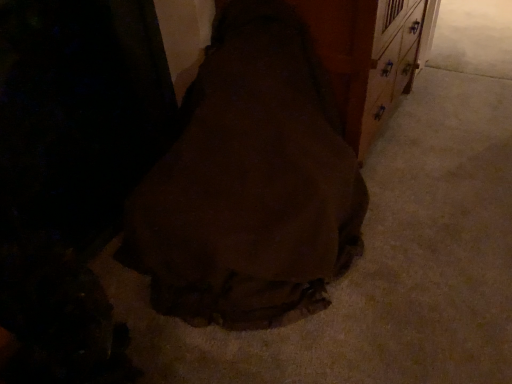
Question: Is brown wood dresser at center taller than brown fabric bag at center?

Choices:
 (A) yes
 (B) no

Answer: (B)

Question: Can you confirm if brown wood dresser at center is wider than brown fabric bag at center?

Choices:
 (A) no
 (B) yes

Answer: (A)

Question: Is brown wood dresser at center looking in the opposite direction of brown fabric bag at center?

Choices:
 (A) no
 (B) yes

Answer: (A)

Question: Is brown wood dresser at center placed right next to brown fabric bag at center?

Choices:
 (A) yes
 (B) no

Answer: (B)

Question: Does brown wood dresser at center have a larger size compared to brown fabric bag at center?

Choices:
 (A) no
 (B) yes

Answer: (A)

Question: Can you confirm if brown wood dresser at center is positioned to the right of brown fabric bag at center?

Choices:
 (A) no
 (B) yes

Answer: (B)

Question: Can brown wood dresser at center be found inside brown fabric bag at center?

Choices:
 (A) yes
 (B) no

Answer: (B)

Question: Does brown fabric bag at center have a greater width compared to brown wood dresser at center?

Choices:
 (A) yes
 (B) no

Answer: (A)

Question: Is brown fabric bag at center looking in the opposite direction of brown wood dresser at center?

Choices:
 (A) no
 (B) yes

Answer: (B)

Question: Is brown fabric bag at center closer to the viewer compared to brown wood dresser at center?

Choices:
 (A) yes
 (B) no

Answer: (A)

Question: Is brown fabric bag at center behind brown wood dresser at center?

Choices:
 (A) no
 (B) yes

Answer: (A)

Question: Is brown fabric bag at center smaller than brown wood dresser at center?

Choices:
 (A) no
 (B) yes

Answer: (A)

Question: Considering the relative positions of brown fabric bag at center and brown wood dresser at center in the image provided, is brown fabric bag at center to the left or to the right of brown wood dresser at center?

Choices:
 (A) left
 (B) right

Answer: (A)